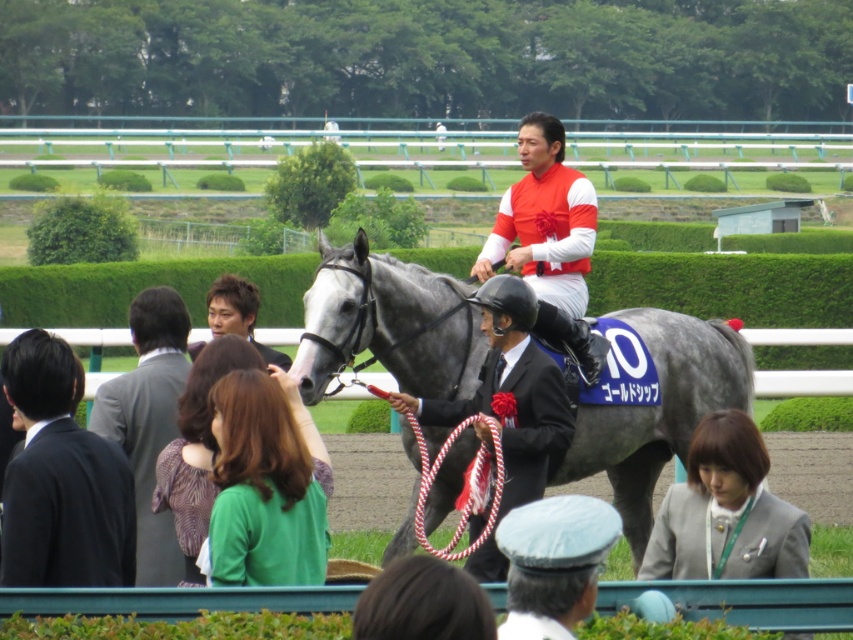
You are a photographer at the horse racing event. You need to capture a photo where both the black glossy suit at center and the gray suit at center are visible. Based on their positions, which one should you focus on first to ensure both are in the frame?

The black glossy suit at center is below the gray suit at center, so you should focus on the gray suit at center first to ensure both are in the frame.

You are a photographer at the horse racing event. You want to take a photo of the black glossy suit at center without the gray glossy horse at center blocking it. Is it possible to do so based on their positions?

The black glossy suit at center is behind the gray glossy horse at center, so it is possible to take a photo of the black glossy suit at center without the gray glossy horse at center blocking it by moving around to the front side of the horse.

You are a photographer at the horse racing event. You want to take a photo of the light blue fabric cap at lower center and the green leafy hedge at upper left. From your current position, which object is closer to you?

The light blue fabric cap at lower center is closer to you because it is in front of the green leafy hedge at upper left.